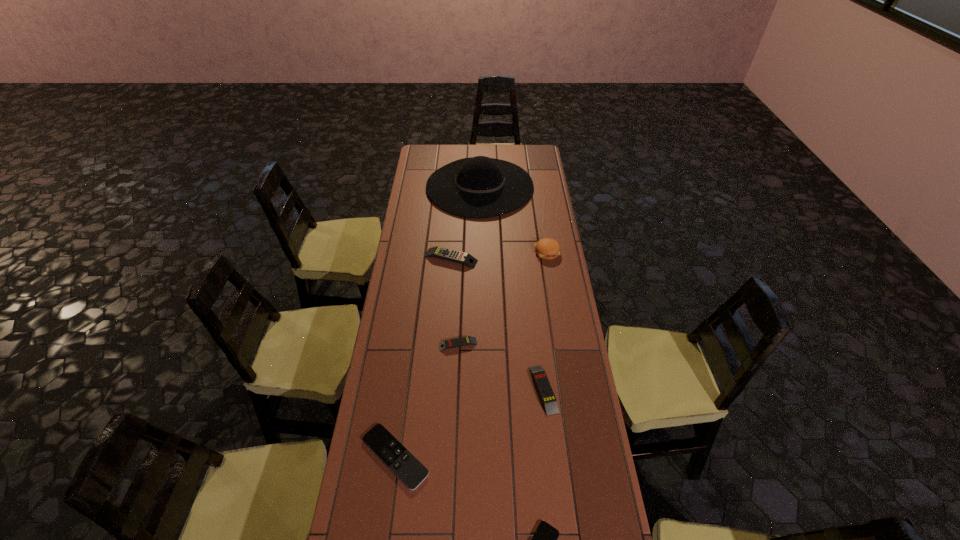
Identify the location of vacant space that's between the patty and the fourth shortest remote control. (545, 320).

Identify the location of vacant space that is in between the fourth farthest object and the farthest remote control. (454, 301).

Choose which object is the nearest neighbor to the third farthest remote control. Please provide its 2D coordinates. Your answer should be formatted as a tuple, i.e. [(x, y)], where the tuple contains the x and y coordinates of a point satisfying the conditions above.

[(467, 340)]

Identify which object is located as the third nearest to the farthest yellow remote control. Please provide its 2D coordinates. Your answer should be formatted as a tuple, i.e. [(x, y)], where the tuple contains the x and y coordinates of a point satisfying the conditions above.

[(467, 340)]

Locate an element on the screen. This screenshot has height=540, width=960. the third closest remote control to the sixth shortest object is located at coordinates (541, 380).

Identify which remote control is the closest to the third nearest remote control. Please provide its 2D coordinates. Your answer should be formatted as a tuple, i.e. [(x, y)], where the tuple contains the x and y coordinates of a point satisfying the conditions above.

[(467, 340)]

The width and height of the screenshot is (960, 540). What are the coordinates of `the third closest yellow remote control relative to the shortest object` in the screenshot? It's located at (443, 253).

Select which yellow remote control appears as the second closest to the patty. Please provide its 2D coordinates. Your answer should be formatted as a tuple, i.e. [(x, y)], where the tuple contains the x and y coordinates of a point satisfying the conditions above.

[(467, 340)]

At what (x,y) coordinates should I click in order to perform the action: click on the second closest black remote control to the patty. Please return your answer as a coordinate pair (x, y). Looking at the image, I should click on (545, 537).

Where is `free space that satisfies the following two spatial constraints: 1. on the front-facing side of the fourth tallest object; 2. on the left side of the tallest object`? free space that satisfies the following two spatial constraints: 1. on the front-facing side of the fourth tallest object; 2. on the left side of the tallest object is located at coordinates (480, 389).